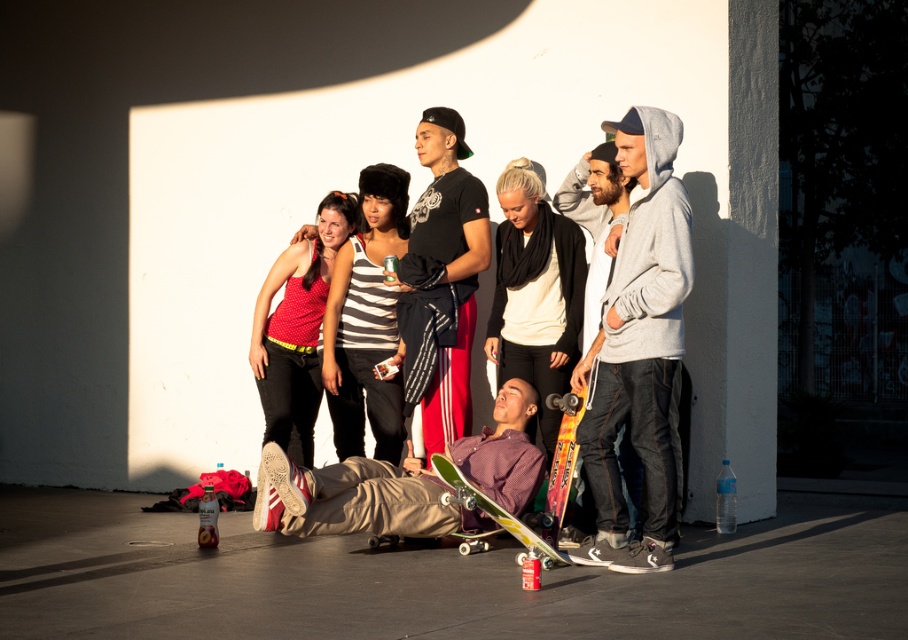
You are standing in the scene and want to move from the point at coordinates point (629, 278) to the point at coordinates point (443, 484). Which direction should you move to reach your destination?

To move from point (629, 278) to point (443, 484), you should move towards the upper right direction since point (443, 484) is located above and to the right of point (629, 278).

You are a photographer trying to capture a group photo of the seven people in the image. You need to position your camera at the center point of the group. Given the gray hoodie at right is at point 0.542, 0.704, where should you place your camera to ensure everyone is in frame?

The gray hoodie at right is located at point (638, 346). To center the camera for the group photo, position it at the average coordinates of all individuals, but since only the gray hoodie at right has coordinates provided, you may need additional data points for accurate placement.